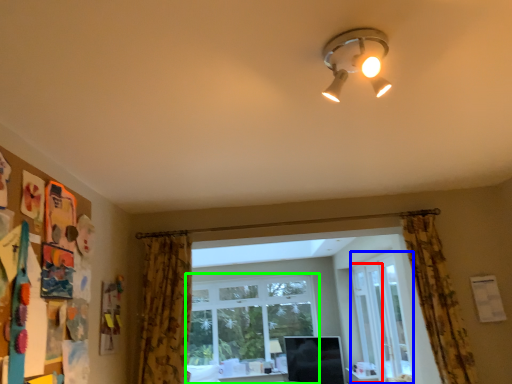
Question: Based on their relative distances, which object is farther from screen door (highlighted by a red box)? Choose from glass door (highlighted by a blue box) and window (highlighted by a green box).

Choices:
 (A) glass door
 (B) window

Answer: (B)